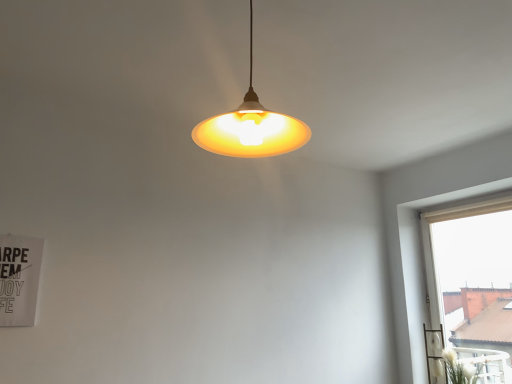
What is the approximate width of matte yellow plastic lampshade at center?

The width of matte yellow plastic lampshade at center is 11.81 inches.

Locate an element on the screen. white fluffy plant at lower right is located at coordinates (459, 368).

Where is `beige fabric curtain at right`? beige fabric curtain at right is located at coordinates (418, 278).

Locate an element on the screen. The height and width of the screenshot is (384, 512). matte yellow plastic lampshade at center is located at coordinates (251, 127).

From a real-world perspective, is beige fabric curtain at right positioned above or below white fluffy plant at lower right?

Clearly, from a real-world perspective, beige fabric curtain at right is above white fluffy plant at lower right.

From the image's perspective, which one is positioned lower, beige fabric curtain at right or white fluffy plant at lower right?

white fluffy plant at lower right, from the image's perspective.

Considering the positions of objects beige fabric curtain at right and white fluffy plant at lower right in the image provided, who is more to the right, beige fabric curtain at right or white fluffy plant at lower right?

beige fabric curtain at right is more to the right.

Who is shorter, beige fabric curtain at right or matte yellow plastic lampshade at center?

matte yellow plastic lampshade at center.

Is beige fabric curtain at right directly adjacent to matte yellow plastic lampshade at center?

No, beige fabric curtain at right is not next to matte yellow plastic lampshade at center.

From the picture: Is beige fabric curtain at right oriented away from matte yellow plastic lampshade at center?

No, beige fabric curtain at right is not facing away from matte yellow plastic lampshade at center.

Which of these two, white fluffy plant at lower right or beige fabric curtain at right, stands shorter?

white fluffy plant at lower right.

Looking at their sizes, would you say white fluffy plant at lower right is wider or thinner than beige fabric curtain at right?

In the image, white fluffy plant at lower right appears to be wider than beige fabric curtain at right.

There is a white fluffy plant at lower right. At what (x,y) coordinates should I click in order to perform the action: click on window above it (from a real-world perspective). Please return your answer as a coordinate pair (x, y). The width and height of the screenshot is (512, 384). Looking at the image, I should click on (418, 278).

From the image's perspective, which one is positioned higher, white fluffy plant at lower right or beige fabric curtain at right?

beige fabric curtain at right is shown above in the image.

From the image's perspective, would you say white fluffy plant at lower right is shown under matte yellow plastic lampshade at center?

Yes, from the image's perspective, white fluffy plant at lower right is beneath matte yellow plastic lampshade at center.

Can you confirm if white fluffy plant at lower right is smaller than matte yellow plastic lampshade at center?

Yes, white fluffy plant at lower right is smaller than matte yellow plastic lampshade at center.

Is point (475, 382) positioned after point (224, 124)?

Yes, point (475, 382) is farther from viewer.

In the image, is white fluffy plant at lower right on the left side or the right side of matte yellow plastic lampshade at center?

Clearly, white fluffy plant at lower right is on the right of matte yellow plastic lampshade at center in the image.

Based on the photo, is matte yellow plastic lampshade at center inside the boundaries of beige fabric curtain at right, or outside?

matte yellow plastic lampshade at center exists outside the volume of beige fabric curtain at right.

How different are the orientations of matte yellow plastic lampshade at center and beige fabric curtain at right in degrees?

There is a 1.28-degree angle between the facing directions of matte yellow plastic lampshade at center and beige fabric curtain at right.

Looking at the image, does matte yellow plastic lampshade at center seem bigger or smaller compared to beige fabric curtain at right?

matte yellow plastic lampshade at center is smaller than beige fabric curtain at right.

From the picture: Would you say matte yellow plastic lampshade at center is outside white fluffy plant at lower right?

Yes, matte yellow plastic lampshade at center is not within white fluffy plant at lower right.

From the image's perspective, is matte yellow plastic lampshade at center located beneath white fluffy plant at lower right?

No, from the image's perspective, matte yellow plastic lampshade at center is not beneath white fluffy plant at lower right.

Does point (277, 122) appear closer or farther from the camera than point (453, 370)?

Point (277, 122) appears to be closer to the viewer than point (453, 370).

Are matte yellow plastic lampshade at center and white fluffy plant at lower right far apart?

Indeed, matte yellow plastic lampshade at center is not near white fluffy plant at lower right.

Identify the location of window above the white fluffy plant at lower right (from a real-world perspective). (418, 278).

The height and width of the screenshot is (384, 512). I want to click on lamp on the left of beige fabric curtain at right, so click(x=251, y=127).

Which object lies further to the anchor point matte yellow plastic lampshade at center, beige fabric curtain at right or white fluffy plant at lower right?

white fluffy plant at lower right is positioned further to the anchor matte yellow plastic lampshade at center.

Considering their positions, is matte yellow plastic lampshade at center positioned further to white fluffy plant at lower right than beige fabric curtain at right?

Based on the image, matte yellow plastic lampshade at center appears to be further to white fluffy plant at lower right.

Estimate the real-world distances between objects in this image. Which object is closer to beige fabric curtain at right, white fluffy plant at lower right or matte yellow plastic lampshade at center?

The object closer to beige fabric curtain at right is white fluffy plant at lower right.

From the image, which object appears to be farther from white fluffy plant at lower right, beige fabric curtain at right or matte yellow plastic lampshade at center?

The object further to white fluffy plant at lower right is matte yellow plastic lampshade at center.

Which object lies further to the anchor point beige fabric curtain at right, matte yellow plastic lampshade at center or white fluffy plant at lower right?

Among the two, matte yellow plastic lampshade at center is located further to beige fabric curtain at right.

Looking at the image, which one is located closer to matte yellow plastic lampshade at center, white fluffy plant at lower right or beige fabric curtain at right?

beige fabric curtain at right.

Where is `window between matte yellow plastic lampshade at center and white fluffy plant at lower right in the front-back direction`? The height and width of the screenshot is (384, 512). window between matte yellow plastic lampshade at center and white fluffy plant at lower right in the front-back direction is located at coordinates (418, 278).